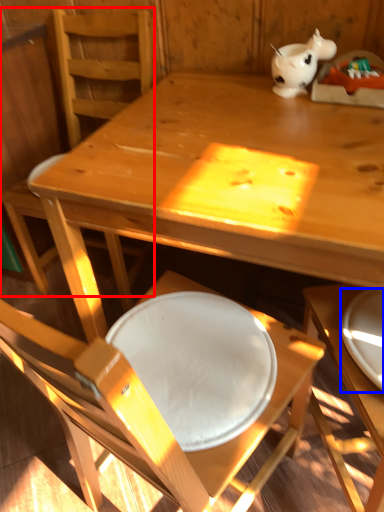
Question: Which point is closer to the camera, chair (highlighted by a red box) or plate (highlighted by a blue box)?

Choices:
 (A) chair
 (B) plate

Answer: (B)